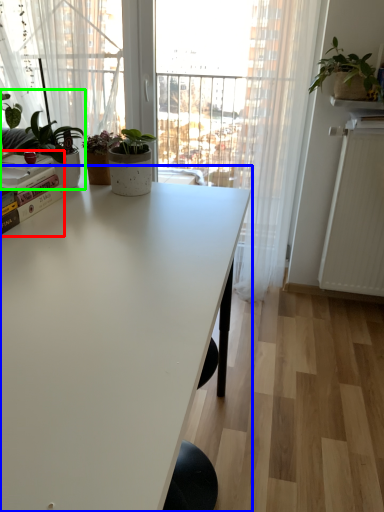
Question: Which object is the closest to the book (highlighted by a red box)? Choose among these: table (highlighted by a blue box) or houseplant (highlighted by a green box).

Choices:
 (A) table
 (B) houseplant

Answer: (B)